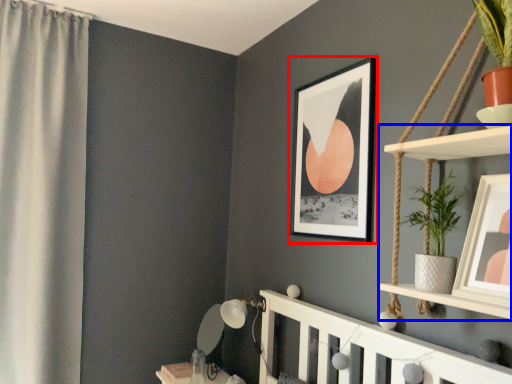
Question: Which object appears closest to the camera in this image, picture frame (highlighted by a red box) or shelf (highlighted by a blue box)?

Choices:
 (A) picture frame
 (B) shelf

Answer: (B)